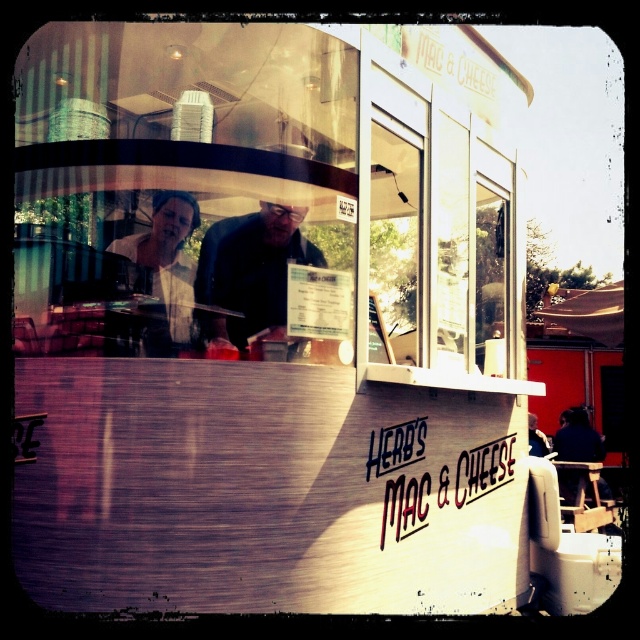
Question: Which point is farther to the camera?

Choices:
 (A) (211, 326)
 (B) (186, 216)

Answer: (B)

Question: Can you confirm if dark brown leather jacket at center is positioned to the left of matte white shirt at upper left?

Choices:
 (A) yes
 (B) no

Answer: (B)

Question: Which point is closer to the camera taking this photo?

Choices:
 (A) (182, 208)
 (B) (236, 230)

Answer: (A)

Question: Can you confirm if dark brown leather jacket at center is positioned above matte white shirt at upper left?

Choices:
 (A) no
 (B) yes

Answer: (A)

Question: Can you confirm if dark brown leather jacket at center is positioned to the left of matte white shirt at upper left?

Choices:
 (A) yes
 (B) no

Answer: (B)